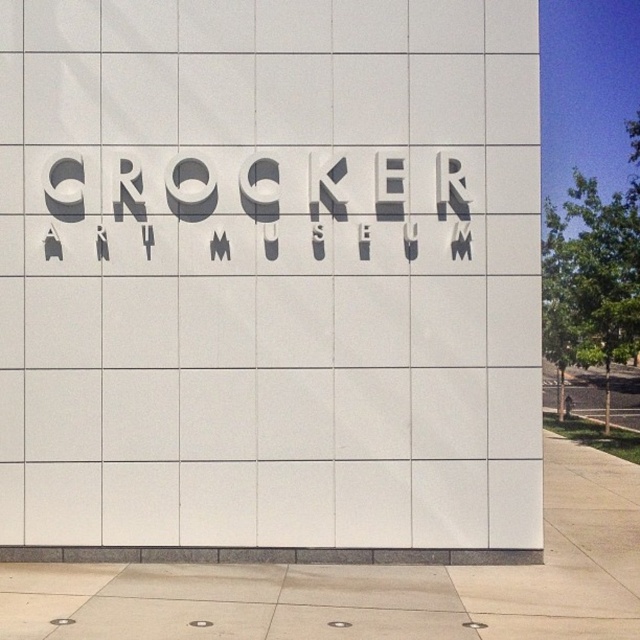
Describe the element at coordinates (269, 275) in the screenshot. The height and width of the screenshot is (640, 640). I see `white matte sign at center` at that location.

Consider the image. Which is more to the left, white matte sign at center or gray concrete pavement at lower center?

white matte sign at center

What are the coordinates of `white matte sign at center` in the screenshot? It's located at (x=269, y=275).